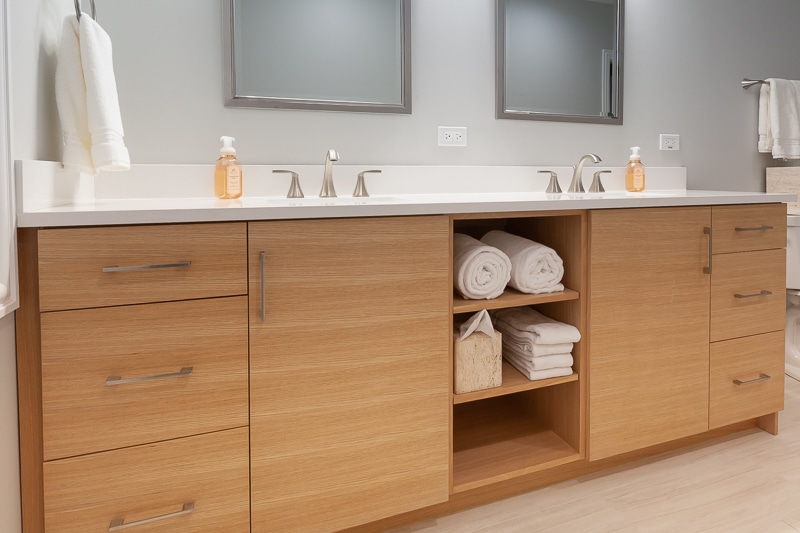
Where is `wall reflection (left mirror)`? This screenshot has height=533, width=800. wall reflection (left mirror) is located at coordinates (333, 28).